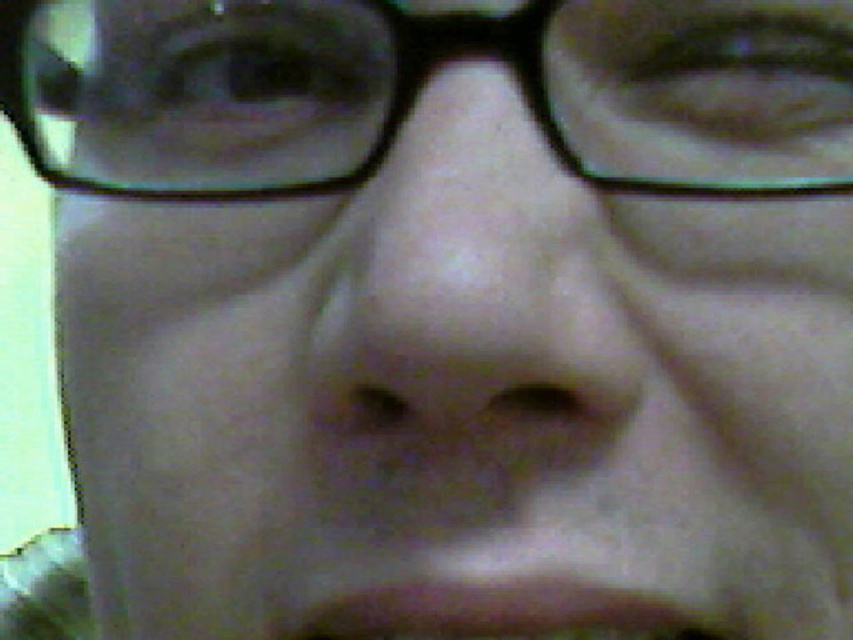
Who is lower down, transparent plastic glasses at upper center or brown matte mouth at lower center?

brown matte mouth at lower center is below.

Which of these two, transparent plastic glasses at upper center or brown matte mouth at lower center, stands taller?

transparent plastic glasses at upper center is taller.

Who is more distant from viewer, (189, 148) or (637, 625)?

The point (189, 148) is more distant.

Image resolution: width=853 pixels, height=640 pixels. What are the coordinates of `transparent plastic glasses at upper center` in the screenshot? It's located at (416, 84).